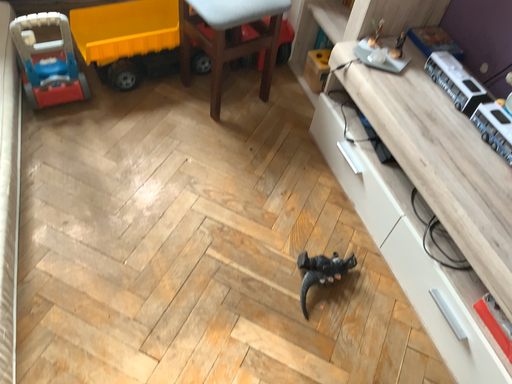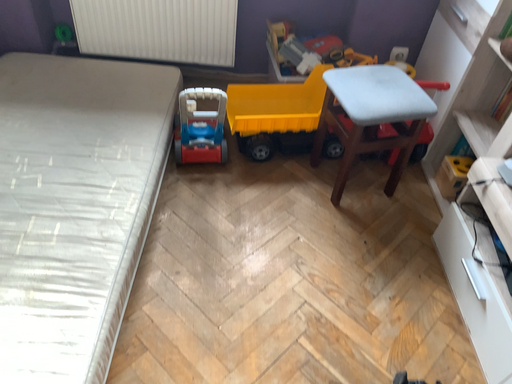
Question: How did the camera likely rotate when shooting the video?

Choices:
 (A) rotated right
 (B) rotated left

Answer: (B)